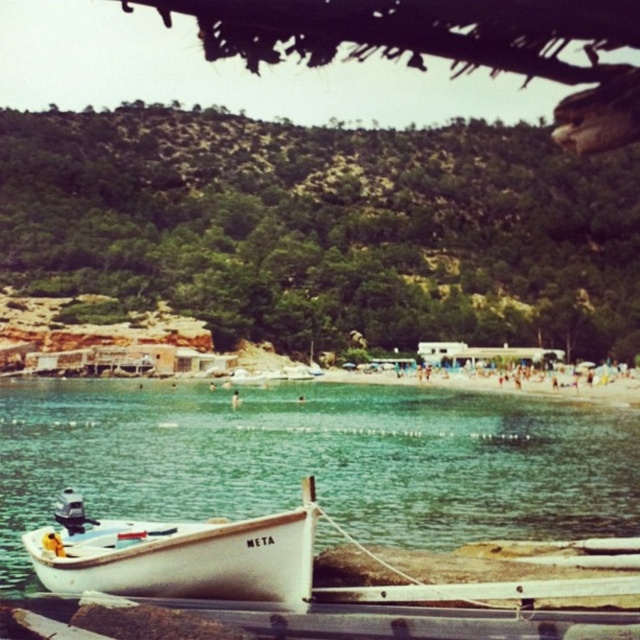
Can you confirm if clear water at boat left is positioned to the left of white matte boat at lower left?

No, clear water at boat left is not to the left of white matte boat at lower left.

Can you confirm if clear water at boat left is positioned below white matte boat at lower left?

No.

The height and width of the screenshot is (640, 640). Identify the location of clear water at boat left. (317, 460).

In order to click on clear water at boat left in this screenshot , I will do `click(317, 460)`.